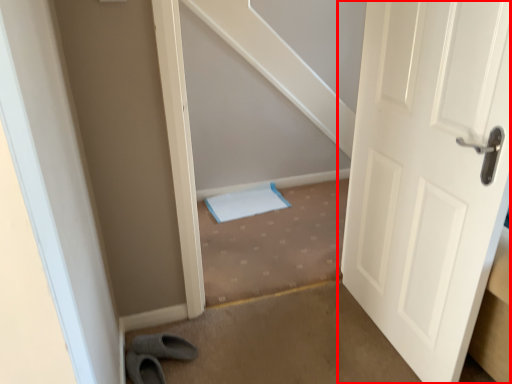
Question: From the image's perspective, considering the relative positions of door (annotated by the red box) and stairwell in the image provided, where is door (annotated by the red box) located with respect to the staircase?

Choices:
 (A) below
 (B) above

Answer: (B)